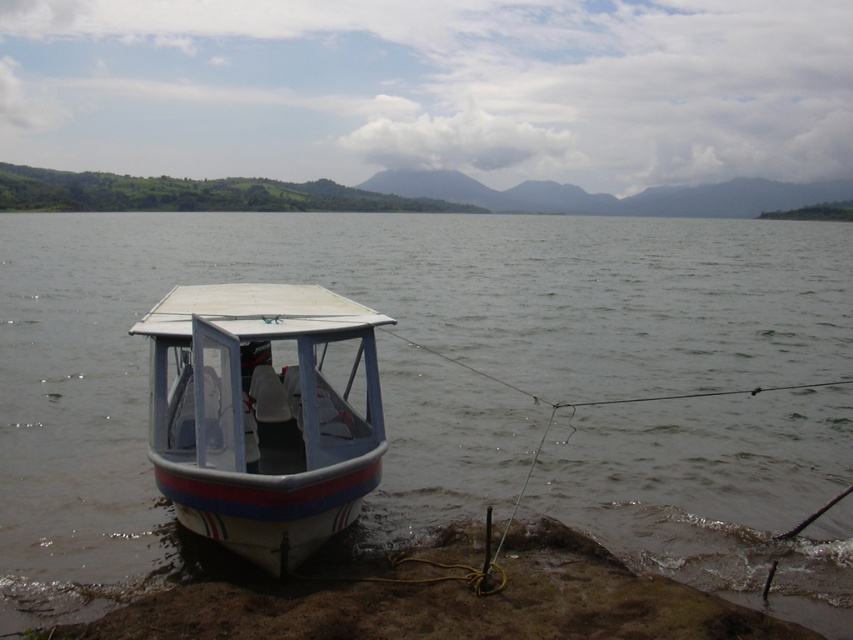
You need to determine if the white matte boat at center can be moved sideways without touching the muddy sand at lower left. Based on their widths, can it fit through the space available?

The white matte boat at center has a lesser width compared to muddy sand at lower left, so it can fit through the space without touching the muddy sand at lower left.